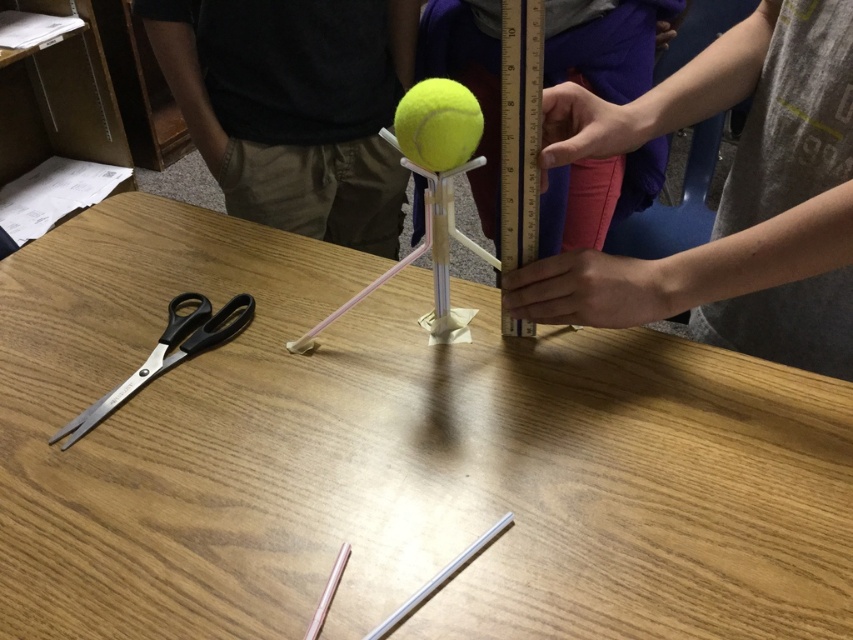
Question: Which of the following is the farthest from the observer?

Choices:
 (A) (195, 445)
 (B) (824, 80)

Answer: (A)

Question: Where is gray cotton shirt at upper right located in relation to yellow rubber tennis ball at center in the image?

Choices:
 (A) left
 (B) right

Answer: (B)

Question: Is gray cotton shirt at upper right above yellow rubber tennis ball at center?

Choices:
 (A) yes
 (B) no

Answer: (A)

Question: Among these points, which one is farthest from the camera?

Choices:
 (A) (444, 120)
 (B) (149, 371)

Answer: (B)

Question: Can you confirm if black plastic scissors at left is smaller than yellow matte tennis ball at center?

Choices:
 (A) no
 (B) yes

Answer: (A)

Question: Based on their relative distances, which object is farther from the black plastic scissors at left?

Choices:
 (A) black matte shirt at upper center
 (B) yellow rubber tennis ball at center
 (C) wooden table at center
 (D) gray cotton shirt at upper right

Answer: (D)